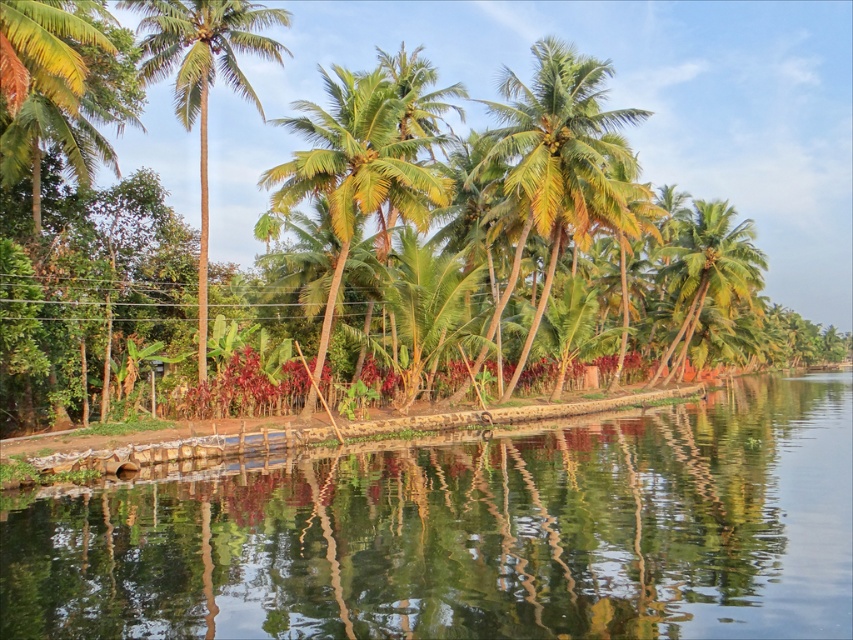
Is the position of green leafy palm trees at center more distant than that of green leafy palm tree at center?

Yes, green leafy palm trees at center is further from the viewer.

Where is `green leafy palm trees at center`? The height and width of the screenshot is (640, 853). green leafy palm trees at center is located at coordinates (563, 156).

Is point (494, 147) farther from camera compared to point (207, 209)?

No.

Identify the location of green leafy palm trees at center. This screenshot has height=640, width=853. click(563, 156).

Between clear water at center and green leafy palm tree at center, which one appears on the left side from the viewer's perspective?

green leafy palm tree at center

Does clear water at center come behind green leafy palm tree at center?

That is False.

Does point (583, 580) come behind point (190, 29)?

No, it is in front of (190, 29).

Identify the location of clear water at center. The height and width of the screenshot is (640, 853). (473, 536).

Does green leafy palm tree at center appear over green leafy palm tree at right?

Correct, green leafy palm tree at center is located above green leafy palm tree at right.

Locate an element on the screen. The width and height of the screenshot is (853, 640). green leafy palm tree at center is located at coordinates (202, 77).

Is point (157, 32) positioned before point (746, 218)?

Yes, it is.

I want to click on green leafy palm tree at center, so click(202, 77).